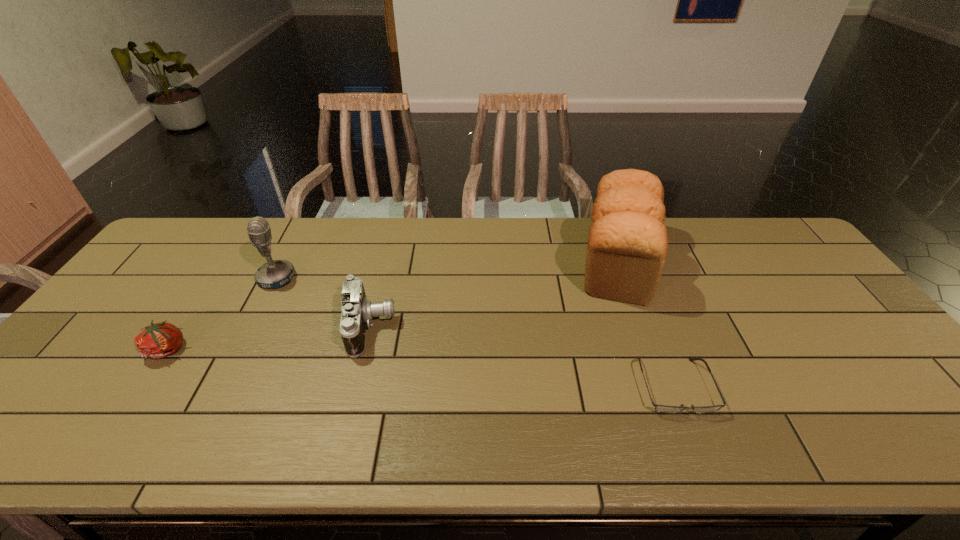
Find the location of a particular element. The image size is (960, 540). bread is located at coordinates (627, 243).

Find the location of a particular element. the fourth object from right to left is located at coordinates (275, 274).

Identify the location of microphone. This screenshot has height=540, width=960. (275, 274).

You are a GUI agent. You are given a task and a screenshot of the screen. Output one action in this format:
    pyautogui.click(x=<x>, y=<y>)
    Task: Click on the camera
    
    Given the screenshot: What is the action you would take?
    pyautogui.click(x=357, y=311)

What are the coordinates of `the third object from left to right` in the screenshot? It's located at (357, 311).

The image size is (960, 540). Find the location of `tomato`. tomato is located at coordinates (159, 340).

The image size is (960, 540). In order to click on the fourth tallest object in this screenshot , I will do `click(159, 340)`.

This screenshot has width=960, height=540. Find the location of `spectacles`. spectacles is located at coordinates (659, 408).

You are a GUI agent. You are given a task and a screenshot of the screen. Output one action in this format:
    pyautogui.click(x=<x>, y=<y>)
    Task: Click on the free spot located 0.200m on the right of the tallest object
    
    Given the screenshot: What is the action you would take?
    pyautogui.click(x=729, y=260)

This screenshot has width=960, height=540. Identify the location of vacant space located 0.130m on the front-facing side of the fourth object from right to left. (339, 278).